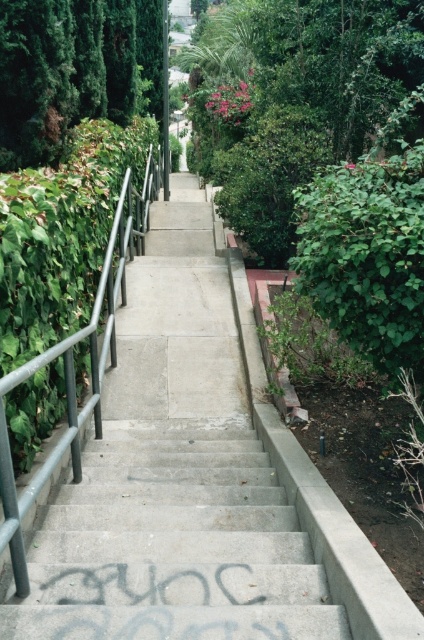
Is point (172, 444) behind point (83, 426)?

Yes, point (172, 444) is behind point (83, 426).

Which is above, concrete stairs at center or metallic gray railing at center?

Positioned higher is metallic gray railing at center.

Does point (5, 600) come in front of point (158, 166)?

Yes, it is.

Where is `concrete stairs at center`? The width and height of the screenshot is (424, 640). concrete stairs at center is located at coordinates (172, 545).